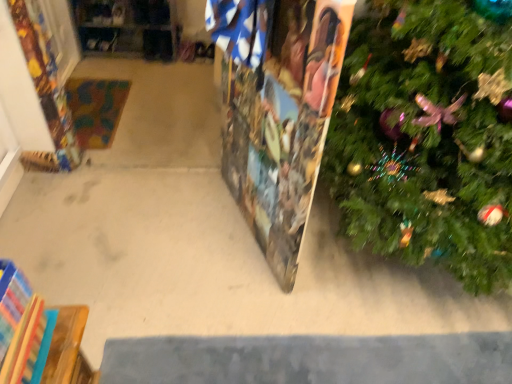
Question: Is green textured christmas tree at right further to the viewer compared to wooden puzzle piece at center?

Choices:
 (A) no
 (B) yes

Answer: (A)

Question: Is green textured christmas tree at right thinner than wooden puzzle piece at center?

Choices:
 (A) no
 (B) yes

Answer: (A)

Question: From the image's perspective, is green textured christmas tree at right beneath wooden puzzle piece at center?

Choices:
 (A) no
 (B) yes

Answer: (A)

Question: Considering the relative sizes of green textured christmas tree at right and wooden puzzle piece at center in the image provided, is green textured christmas tree at right smaller than wooden puzzle piece at center?

Choices:
 (A) no
 (B) yes

Answer: (A)

Question: Is green textured christmas tree at right wider than wooden puzzle piece at center?

Choices:
 (A) yes
 (B) no

Answer: (A)

Question: From the image's perspective, is green textured christmas tree at right located above wooden puzzle piece at center?

Choices:
 (A) yes
 (B) no

Answer: (A)

Question: Is the position of wooden at left more distant than that of green textured christmas tree at right?

Choices:
 (A) yes
 (B) no

Answer: (A)

Question: Is wooden at left at the left side of green textured christmas tree at right?

Choices:
 (A) yes
 (B) no

Answer: (A)

Question: Considering the relative positions of wooden at left and green textured christmas tree at right in the image provided, is wooden at left in front of green textured christmas tree at right?

Choices:
 (A) no
 (B) yes

Answer: (A)

Question: Can you confirm if wooden at left is bigger than green textured christmas tree at right?

Choices:
 (A) no
 (B) yes

Answer: (A)

Question: Is wooden at left not inside green textured christmas tree at right?

Choices:
 (A) no
 (B) yes

Answer: (B)

Question: Is wooden at left facing towards green textured christmas tree at right?

Choices:
 (A) no
 (B) yes

Answer: (A)

Question: From the image's perspective, does wooden puzzle piece at center appear higher than wooden at left?

Choices:
 (A) no
 (B) yes

Answer: (A)